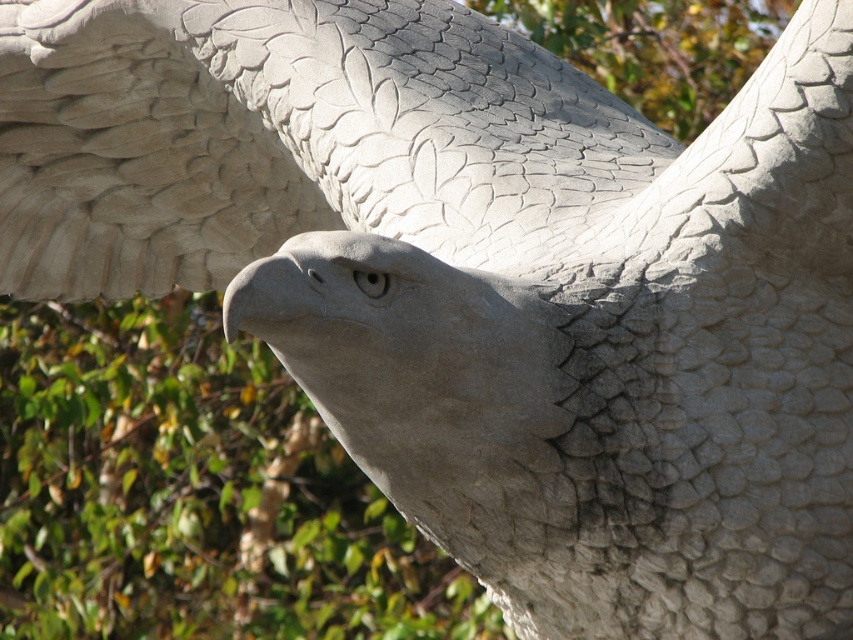
From the picture: Can you confirm if gray stone wing at upper left is positioned above green leafy tree at center?

Yes, gray stone wing at upper left is above green leafy tree at center.

Which is more to the left, gray stone wing at upper left or green leafy tree at center?

green leafy tree at center is more to the left.

This screenshot has width=853, height=640. Describe the element at coordinates (291, 140) in the screenshot. I see `gray stone wing at upper left` at that location.

At what (x,y) coordinates should I click in order to perform the action: click on gray stone wing at upper left. Please return your answer as a coordinate pair (x, y). The height and width of the screenshot is (640, 853). Looking at the image, I should click on (291, 140).